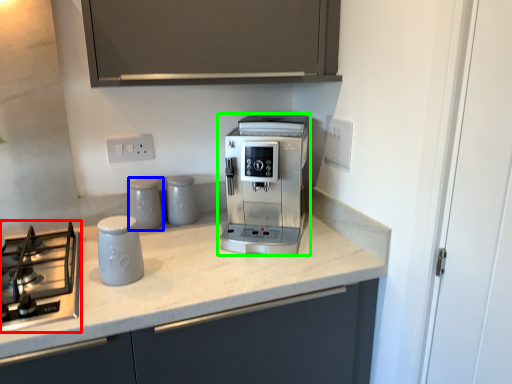
Question: Which object is the farthest from home appliance (highlighted by a red box)? Choose among these: kitchen appliance (highlighted by a blue box) or coffee maker (highlighted by a green box).

Choices:
 (A) kitchen appliance
 (B) coffee maker

Answer: (B)